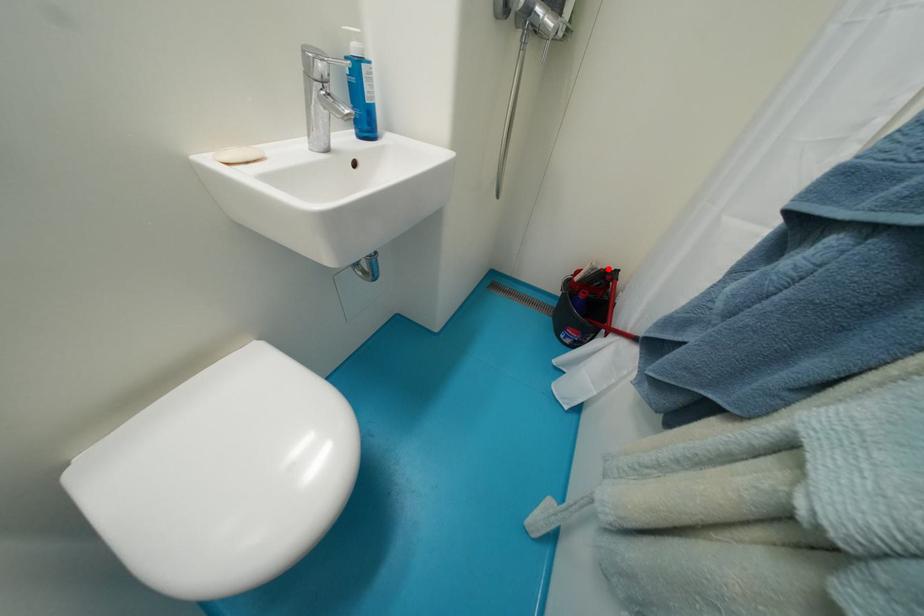
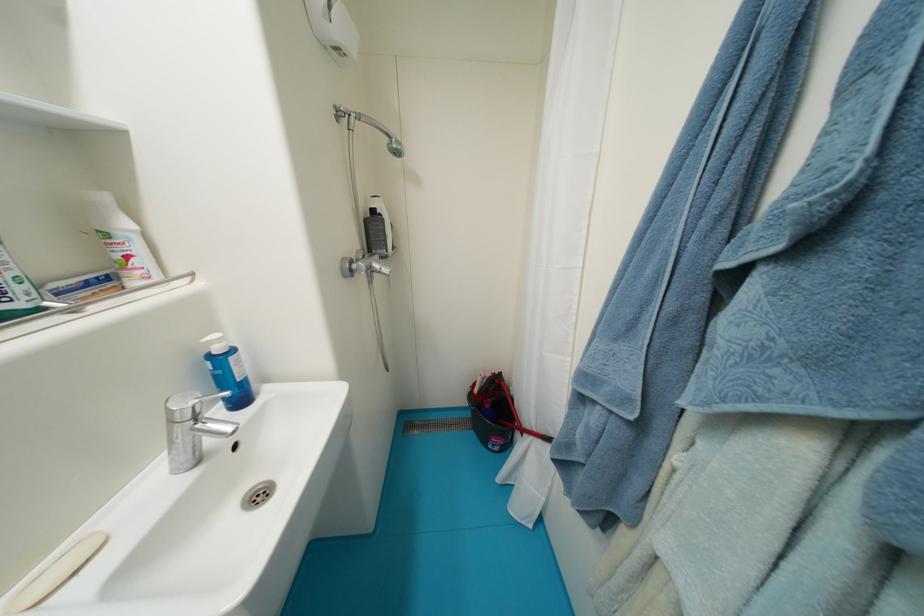
Where in the second image is the point corresponding to the highlighted location from the first image?

(495, 377)